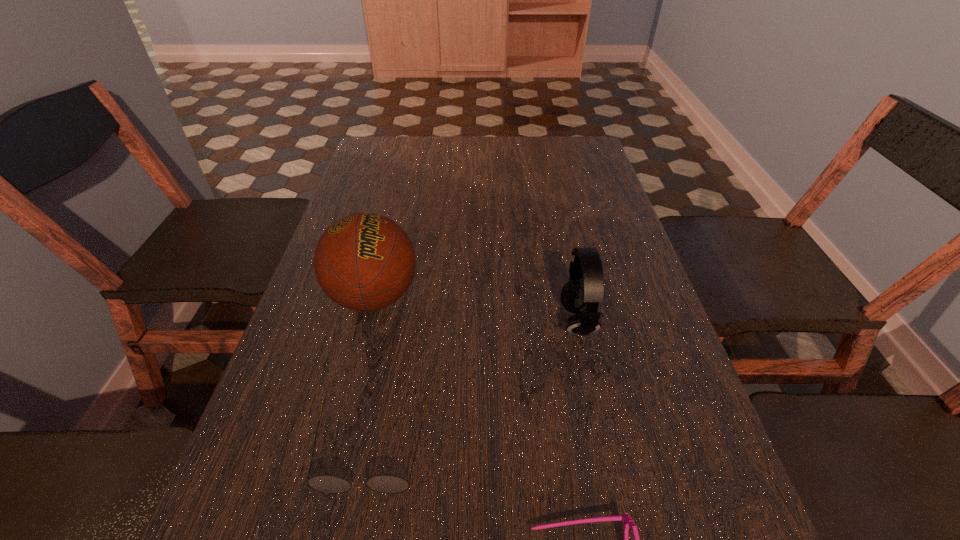
At what (x,y) coordinates should I click in order to perform the action: click on free spot that satisfies the following two spatial constraints: 1. on the ear cups of the earphone; 2. on the temples of the left spectacles. Please return your answer as a coordinate pair (x, y). This screenshot has height=540, width=960. Looking at the image, I should click on (604, 450).